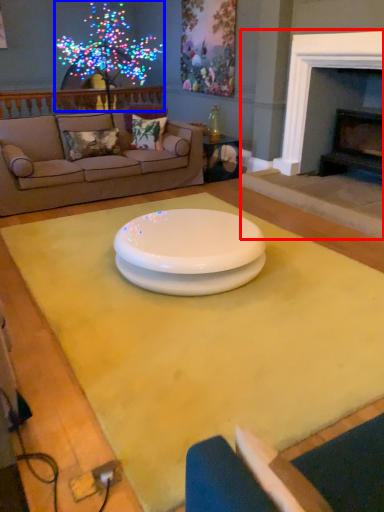
Question: Which object is further to the camera taking this photo, fireplace (highlighted by a red box) or christmas decoration (highlighted by a blue box)?

Choices:
 (A) fireplace
 (B) christmas decoration

Answer: (B)